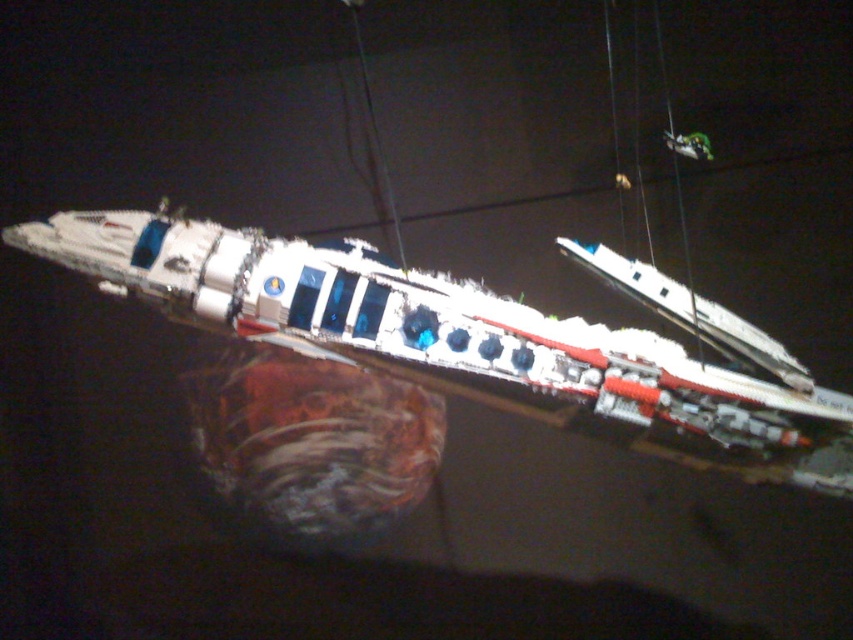
You are an astronaut on a space station and need to move a tool from the white plastic boat at center to the green plastic toy at upper right. The space station has strict safety protocols requiring that any object moved must not exceed a distance of 60 centimeters to prevent drifting. Can you safely move the tool between these two objects without violating the protocols?

The white plastic boat at center and green plastic toy at upper right are 62.85 centimeters apart, which exceeds the 60 centimeter limit. Moving the tool between them would violate the safety protocols.

You are standing in front of a LEGO spaceship model. There is a point with coordinates point (476, 339). Which object is this point located on?

The point (476, 339) is located on the white plastic boat at center.

You are an astronaut on a space station and you see the white plastic boat at center and the green plastic toy at upper right. Which object is taller?

The white plastic boat at center is taller than the green plastic toy at upper right according to the description.